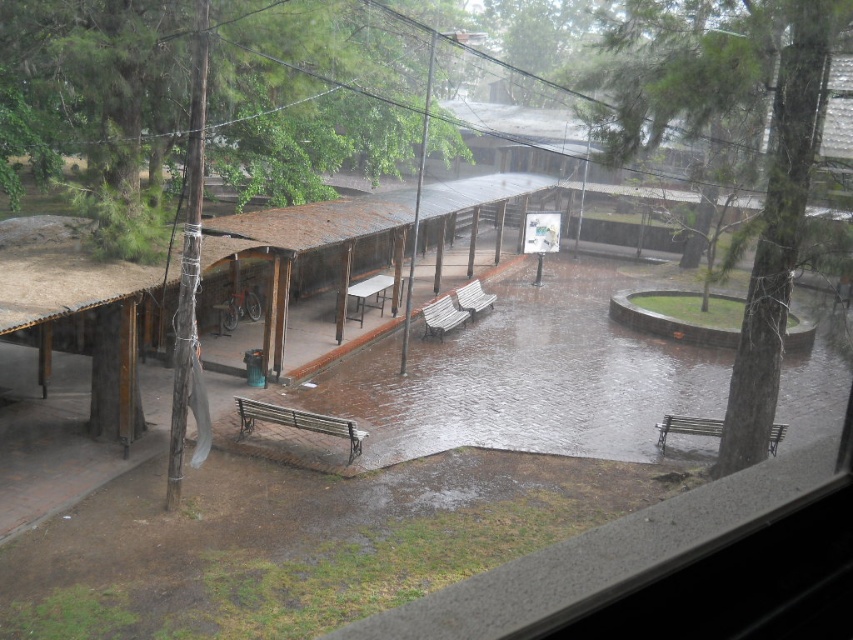
You are standing inside the building looking out the window. You see a white glossy picnic table at center and a wooden bench at center in the courtyard. Which object is closer to the window?

The white glossy picnic table at center is closer to the window because it is in front of the wooden bench at center.

You are planning to set up a small event in the courtyard and need to place a 3x3 meter tent. Given the rusty metal shelter at center and the wooden bench at lower right, which object would be more suitable to position the tent near without obstructing the shelter?

The wooden bench at lower right is smaller, so positioning the tent near it would be more suitable to avoid obstructing the larger rusty metal shelter at center.